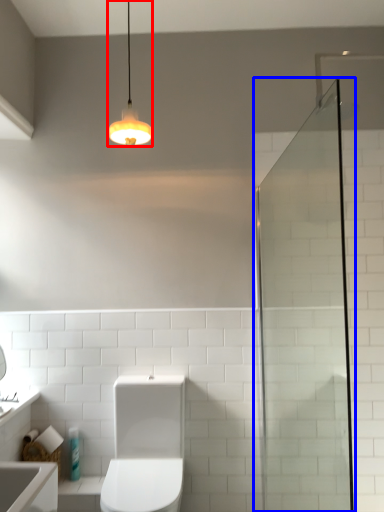
Question: Which object appears farthest to the camera in this image, light fixture (highlighted by a red box) or screen door (highlighted by a blue box)?

Choices:
 (A) light fixture
 (B) screen door

Answer: (A)